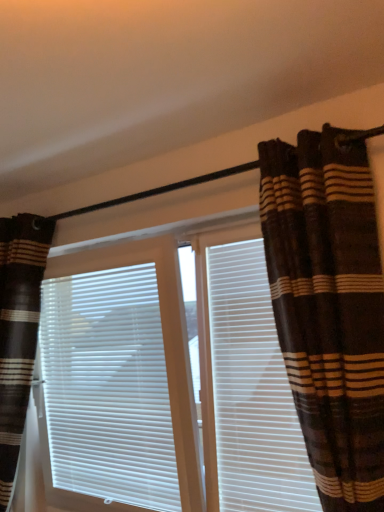
Question: In the image, is brown striped curtains at center positioned in front of or behind white plastic shutter at center?

Choices:
 (A) behind
 (B) front

Answer: (B)

Question: Is brown striped curtains at center spatially inside white plastic shutter at center, or outside of it?

Choices:
 (A) inside
 (B) outside

Answer: (B)

Question: Estimate the real-world distances between objects in this image. Which object is closer to the white plastic shutter at center?

Choices:
 (A) white matte window blind at center
 (B) brown striped curtains at center
 (C) brown striped curtain at right, the 1th curtain positioned from the front
 (D) brown striped curtain at left, marked as the second curtain in a right-to-left arrangement

Answer: (B)

Question: Which object is positioned farthest from the white matte window blind at center?

Choices:
 (A) brown striped curtain at left, marked as the second curtain in a right-to-left arrangement
 (B) brown striped curtains at center
 (C) white plastic shutter at center
 (D) brown striped curtain at right, the 1th curtain positioned from the front

Answer: (D)